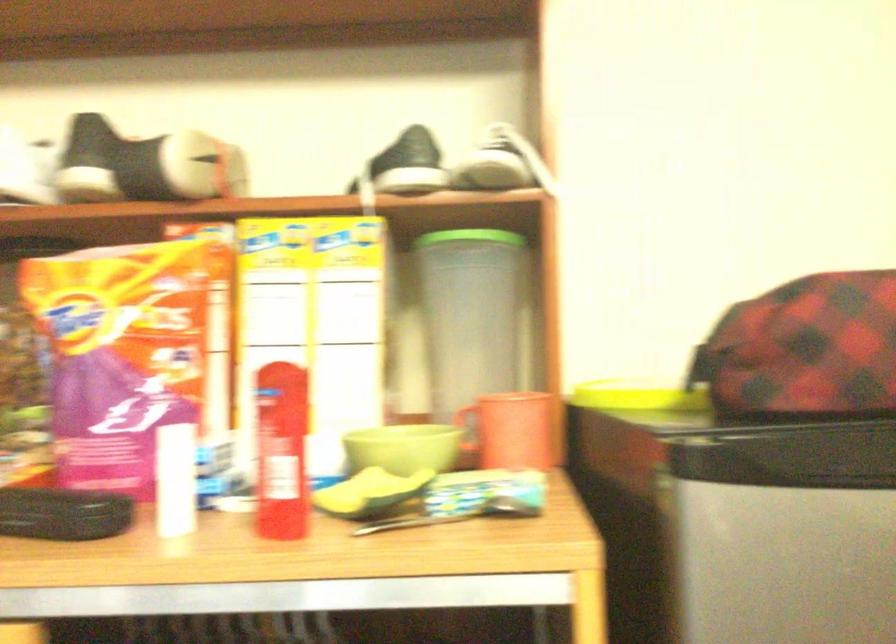
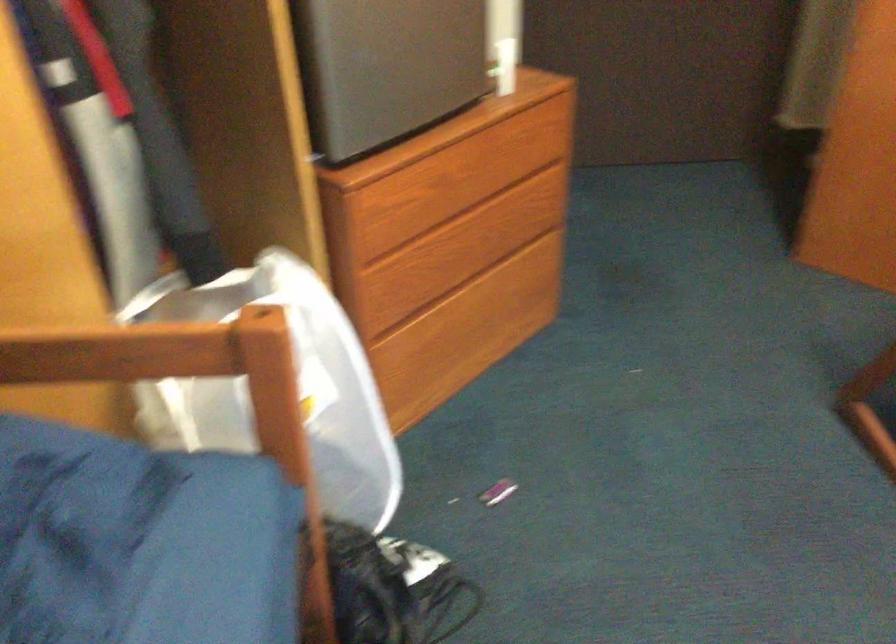
First-person continuous shooting, in which direction is the camera rotating?

The camera rotated toward right-down.